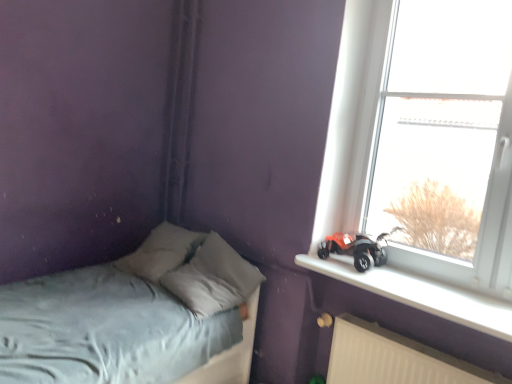
The width and height of the screenshot is (512, 384). I want to click on free point below orange matte toy car at window sill (from a real-world perspective), so click(364, 266).